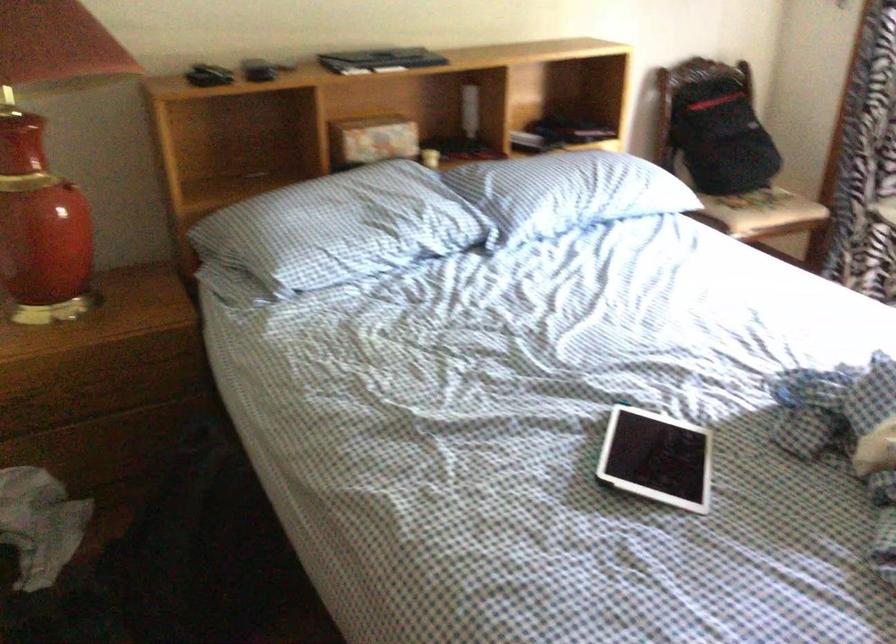
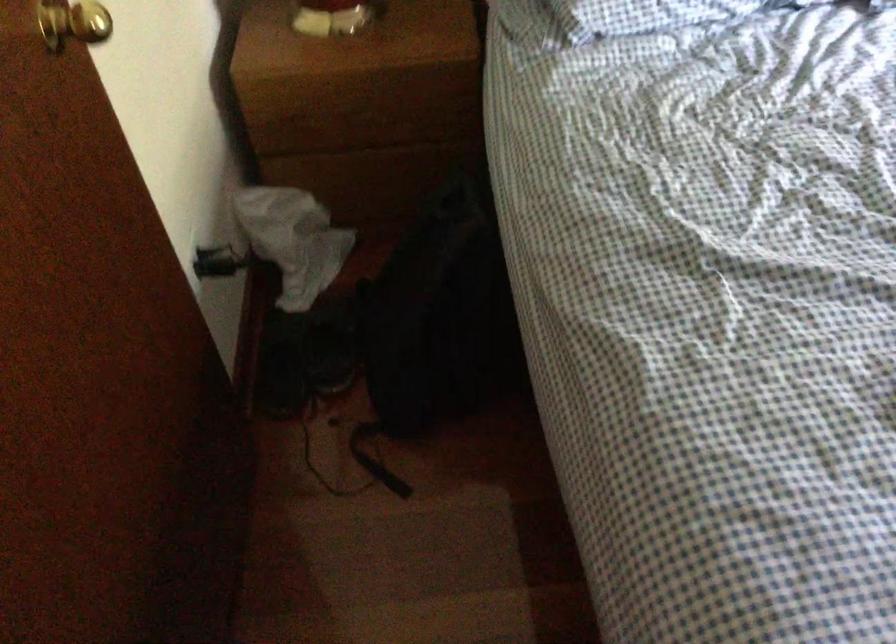
The images are taken continuously from a first-person perspective. In which direction is your viewpoint rotating?

The camera rotated toward left-down.